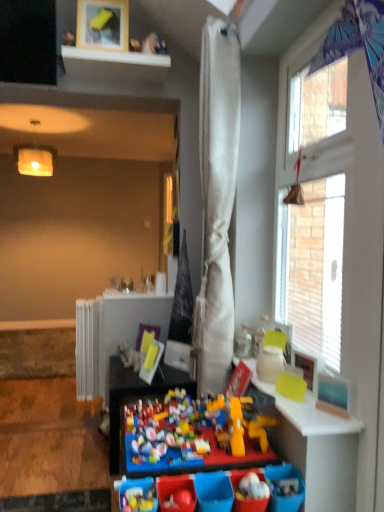
Question: Does white fabric curtain at center have a greater width compared to white glossy shelf at upper center?

Choices:
 (A) no
 (B) yes

Answer: (A)

Question: Is white fabric curtain at center aimed at white glossy shelf at upper center?

Choices:
 (A) no
 (B) yes

Answer: (A)

Question: Does white fabric curtain at center come behind white glossy shelf at upper center?

Choices:
 (A) no
 (B) yes

Answer: (A)

Question: Considering the relative sizes of white fabric curtain at center and white glossy shelf at upper center in the image provided, is white fabric curtain at center thinner than white glossy shelf at upper center?

Choices:
 (A) no
 (B) yes

Answer: (B)

Question: Would you say white fabric curtain at center is a long distance from white glossy shelf at upper center?

Choices:
 (A) no
 (B) yes

Answer: (A)

Question: Considering the relative sizes of white fabric curtain at center and white glossy shelf at upper center in the image provided, is white fabric curtain at center taller than white glossy shelf at upper center?

Choices:
 (A) no
 (B) yes

Answer: (B)

Question: Is white fabric curtain at center facing away from brick-like plastic toy at center?

Choices:
 (A) yes
 (B) no

Answer: (B)

Question: Is white fabric curtain at center positioned behind brick-like plastic toy at center?

Choices:
 (A) no
 (B) yes

Answer: (B)

Question: Is white fabric curtain at center to the right of brick-like plastic toy at center from the viewer's perspective?

Choices:
 (A) yes
 (B) no

Answer: (A)

Question: Does white fabric curtain at center have a smaller size compared to brick-like plastic toy at center?

Choices:
 (A) yes
 (B) no

Answer: (A)

Question: Is white fabric curtain at center shorter than brick-like plastic toy at center?

Choices:
 (A) no
 (B) yes

Answer: (A)

Question: Is white fabric curtain at center facing towards brick-like plastic toy at center?

Choices:
 (A) yes
 (B) no

Answer: (B)

Question: Does multicolored plastic lego at center, the first table when ordered from back to front, have a greater height compared to white textured curtain at upper right?

Choices:
 (A) yes
 (B) no

Answer: (B)